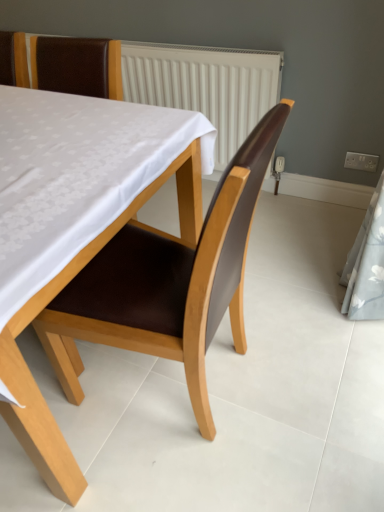
At what (x,y) coordinates should I click in order to perform the action: click on free space in front of brown leather chair at center, the 1th chair ordered from the bottom. Please return your answer as a coordinate pair (x, y). Image resolution: width=384 pixels, height=512 pixels. Looking at the image, I should click on (186, 464).